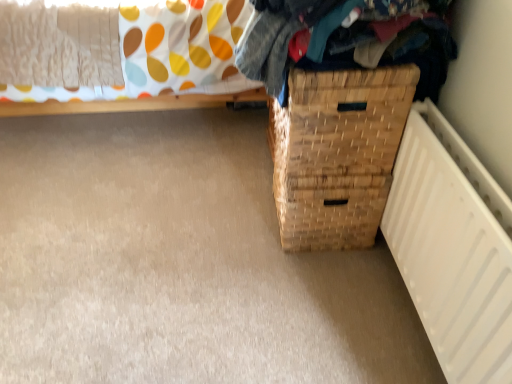
Question: From a real-world perspective, is white matte radiator at lower right physically below woven wood basket at lower right?

Choices:
 (A) no
 (B) yes

Answer: (B)

Question: Is white matte radiator at lower right thinner than woven wood basket at lower right?

Choices:
 (A) yes
 (B) no

Answer: (A)

Question: Is white matte radiator at lower right smaller than woven wood basket at lower right?

Choices:
 (A) yes
 (B) no

Answer: (A)

Question: Does white matte radiator at lower right have a lesser height compared to woven wood basket at lower right?

Choices:
 (A) no
 (B) yes

Answer: (B)

Question: Is white matte radiator at lower right located outside woven wood basket at lower right?

Choices:
 (A) yes
 (B) no

Answer: (A)

Question: From the image's perspective, would you say white matte radiator at lower right is positioned over woven wood basket at lower right?

Choices:
 (A) yes
 (B) no

Answer: (B)

Question: From the image's perspective, does woven fabric clothes at upper right appear higher than woven wood basket at lower right?

Choices:
 (A) yes
 (B) no

Answer: (A)

Question: Is woven fabric clothes at upper right aimed at woven wood basket at lower right?

Choices:
 (A) no
 (B) yes

Answer: (A)

Question: Considering the relative sizes of woven fabric clothes at upper right and woven wood basket at lower right in the image provided, is woven fabric clothes at upper right bigger than woven wood basket at lower right?

Choices:
 (A) no
 (B) yes

Answer: (B)

Question: From a real-world perspective, is woven fabric clothes at upper right positioned over woven wood basket at lower right based on gravity?

Choices:
 (A) yes
 (B) no

Answer: (A)

Question: From a real-world perspective, is woven fabric clothes at upper right positioned under woven wood basket at lower right based on gravity?

Choices:
 (A) no
 (B) yes

Answer: (A)

Question: Is woven fabric clothes at upper right touching woven wood basket at lower right?

Choices:
 (A) yes
 (B) no

Answer: (B)

Question: Considering the relative sizes of white matte radiator at lower right and woven fabric clothes at upper right in the image provided, is white matte radiator at lower right taller than woven fabric clothes at upper right?

Choices:
 (A) no
 (B) yes

Answer: (B)